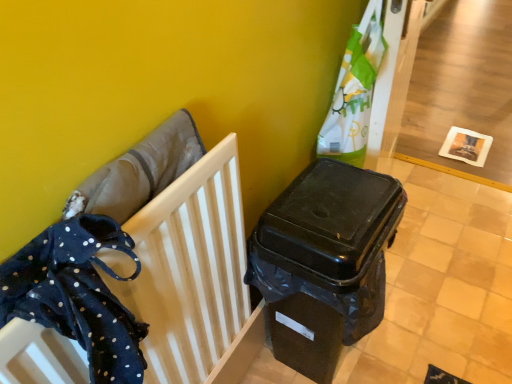
This screenshot has width=512, height=384. Identify the location of dark blue polka dot fabric at left. (77, 294).

Is dark blue fabric at left positioned with its back to dark blue polka dot fabric at left?

Absolutely, dark blue fabric at left is directed away from dark blue polka dot fabric at left.

Is point (63, 270) less distant than point (49, 249)?

Yes, it is in front of point (49, 249).

Considering the relative positions of dark blue fabric at left and dark blue polka dot fabric at left in the image provided, is dark blue fabric at left behind dark blue polka dot fabric at left?

Yes, it is.

From the image's perspective, is dark blue fabric at left above or below dark blue polka dot fabric at left?

Clearly, from the image's perspective, dark blue fabric at left is below dark blue polka dot fabric at left.

Consider the image. From the image's perspective, which object appears higher, dark blue polka dot fabric at left or dark blue fabric at left?

dark blue polka dot fabric at left is shown above in the image.

Does point (116, 245) appear closer or farther from the camera than point (55, 359)?

Clearly, point (116, 245) is more distant from the camera than point (55, 359).

Would you say dark blue polka dot fabric at left is inside or outside dark blue fabric at left?

The correct answer is: inside.

From a real-world perspective, is dark blue polka dot fabric at left above or below dark blue fabric at left?

dark blue polka dot fabric at left is situated higher than dark blue fabric at left in the real world.

Considering the relative sizes of black plastic waste container at center-right and dark blue polka dot fabric at left in the image provided, is black plastic waste container at center-right bigger than dark blue polka dot fabric at left?

Correct, black plastic waste container at center-right is larger in size than dark blue polka dot fabric at left.

From the image's perspective, relative to dark blue polka dot fabric at left, is black plastic waste container at center-right above or below?

From the image's perspective, black plastic waste container at center-right appears below dark blue polka dot fabric at left.

Can you see black plastic waste container at center-right touching dark blue polka dot fabric at left?

They are not placed beside each other.

Which is nearer, (333, 367) or (42, 290)?

Point (333, 367) is farther from the camera than point (42, 290).

Is dark blue fabric at left far from black plastic waste container at center-right?

No, dark blue fabric at left is in close proximity to black plastic waste container at center-right.

Based on the photo, can you confirm if dark blue fabric at left is thinner than black plastic waste container at center-right?

Correct, the width of dark blue fabric at left is less than that of black plastic waste container at center-right.

Image resolution: width=512 pixels, height=384 pixels. In order to click on furniture in front of the black plastic waste container at center-right in this screenshot , I will do `click(133, 271)`.

Can you confirm if dark blue fabric at left is bigger than black plastic waste container at center-right?

Actually, dark blue fabric at left might be smaller than black plastic waste container at center-right.

Which object is closer to the camera taking this photo, dark blue polka dot fabric at left or black plastic waste container at center-right?

dark blue polka dot fabric at left is closer to the camera.

From the image's perspective, which one is positioned lower, dark blue polka dot fabric at left or black plastic waste container at center-right?

black plastic waste container at center-right appears lower in the image.

Between dark blue polka dot fabric at left and black plastic waste container at center-right, which one appears on the right side from the viewer's perspective?

black plastic waste container at center-right is more to the right.

Is dark blue polka dot fabric at left not within black plastic waste container at center-right?

Absolutely, dark blue polka dot fabric at left is external to black plastic waste container at center-right.

Locate an element on the screen. waste container above the dark blue fabric at left (from the image's perspective) is located at coordinates (325, 259).

From the image's perspective, which one is positioned higher, black plastic waste container at center-right or dark blue fabric at left?

black plastic waste container at center-right appears higher in the image.

Which of these two, black plastic waste container at center-right or dark blue fabric at left, stands shorter?

With less height is dark blue fabric at left.

Considering the relative sizes of black plastic waste container at center-right and dark blue fabric at left in the image provided, is black plastic waste container at center-right smaller than dark blue fabric at left?

Incorrect, black plastic waste container at center-right is not smaller in size than dark blue fabric at left.

Image resolution: width=512 pixels, height=384 pixels. In order to click on furniture below the dark blue polka dot fabric at left (from a real-world perspective) in this screenshot , I will do `click(133, 271)`.

Locate an element on the screen. clothe above the dark blue fabric at left (from a real-world perspective) is located at coordinates (77, 294).

From the image, which object appears to be farther from black plastic waste container at center-right, dark blue polka dot fabric at left or dark blue fabric at left?

→ dark blue polka dot fabric at left is further to black plastic waste container at center-right.

Based on their spatial positions, is black plastic waste container at center-right or dark blue fabric at left further from dark blue polka dot fabric at left?

black plastic waste container at center-right is further to dark blue polka dot fabric at left.

When comparing their distances from dark blue polka dot fabric at left, does dark blue fabric at left or black plastic waste container at center-right seem closer?

Among the two, dark blue fabric at left is located nearer to dark blue polka dot fabric at left.

Based on their spatial positions, is dark blue polka dot fabric at left or black plastic waste container at center-right further from dark blue fabric at left?

black plastic waste container at center-right lies further to dark blue fabric at left than the other object.

Estimate the real-world distances between objects in this image. Which object is closer to black plastic waste container at center-right, dark blue fabric at left or dark blue polka dot fabric at left?

The object closer to black plastic waste container at center-right is dark blue fabric at left.

When comparing their distances from dark blue fabric at left, does black plastic waste container at center-right or dark blue polka dot fabric at left seem further?

Among the two, black plastic waste container at center-right is located further to dark blue fabric at left.

Where is `furniture between dark blue polka dot fabric at left and black plastic waste container at center-right from left to right`? The height and width of the screenshot is (384, 512). furniture between dark blue polka dot fabric at left and black plastic waste container at center-right from left to right is located at coordinates (133, 271).